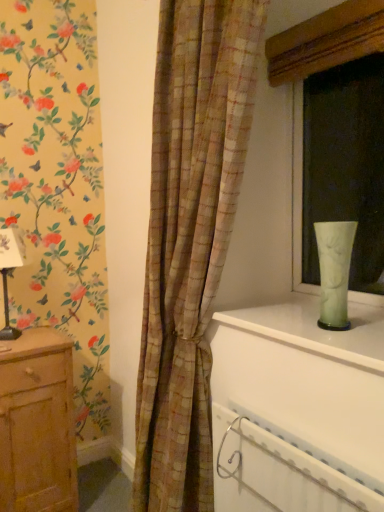
Question: Is matte glass vase at right shorter than white plastic radiator at lower right?

Choices:
 (A) no
 (B) yes

Answer: (A)

Question: Is matte glass vase at right not inside white plastic radiator at lower right?

Choices:
 (A) no
 (B) yes

Answer: (B)

Question: From a real-world perspective, does matte glass vase at right stand above white plastic radiator at lower right?

Choices:
 (A) yes
 (B) no

Answer: (A)

Question: Is white plastic radiator at lower right at the back of matte glass vase at right?

Choices:
 (A) no
 (B) yes

Answer: (A)

Question: Is matte glass vase at right at the left side of white plastic radiator at lower right?

Choices:
 (A) no
 (B) yes

Answer: (A)

Question: Does matte glass vase at right have a greater width compared to white plastic radiator at lower right?

Choices:
 (A) yes
 (B) no

Answer: (A)

Question: From a real-world perspective, is wooden chest of drawers at left positioned over white plastic radiator at lower right based on gravity?

Choices:
 (A) no
 (B) yes

Answer: (A)

Question: Is wooden chest of drawers at left to the left of white plastic radiator at lower right from the viewer's perspective?

Choices:
 (A) yes
 (B) no

Answer: (A)

Question: Is wooden chest of drawers at left thinner than white plastic radiator at lower right?

Choices:
 (A) no
 (B) yes

Answer: (A)

Question: Is wooden chest of drawers at left far from white plastic radiator at lower right?

Choices:
 (A) no
 (B) yes

Answer: (A)

Question: Is wooden chest of drawers at left at the right side of white plastic radiator at lower right?

Choices:
 (A) yes
 (B) no

Answer: (B)

Question: Does wooden chest of drawers at left have a larger size compared to white plastic radiator at lower right?

Choices:
 (A) no
 (B) yes

Answer: (B)

Question: Are wooden chest of drawers at left and plaid fabric curtain at center far apart?

Choices:
 (A) yes
 (B) no

Answer: (B)